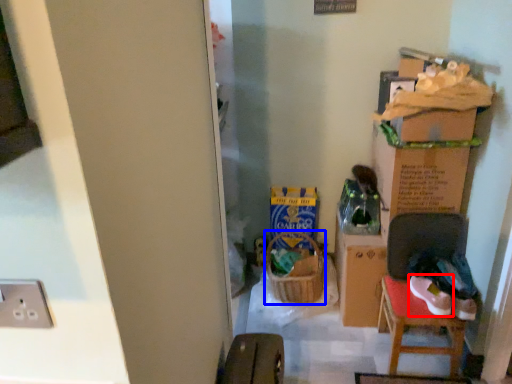
Question: Which object is closer to the camera taking this photo, footwear (highlighted by a red box) or laundry basket (highlighted by a blue box)?

Choices:
 (A) footwear
 (B) laundry basket

Answer: (A)